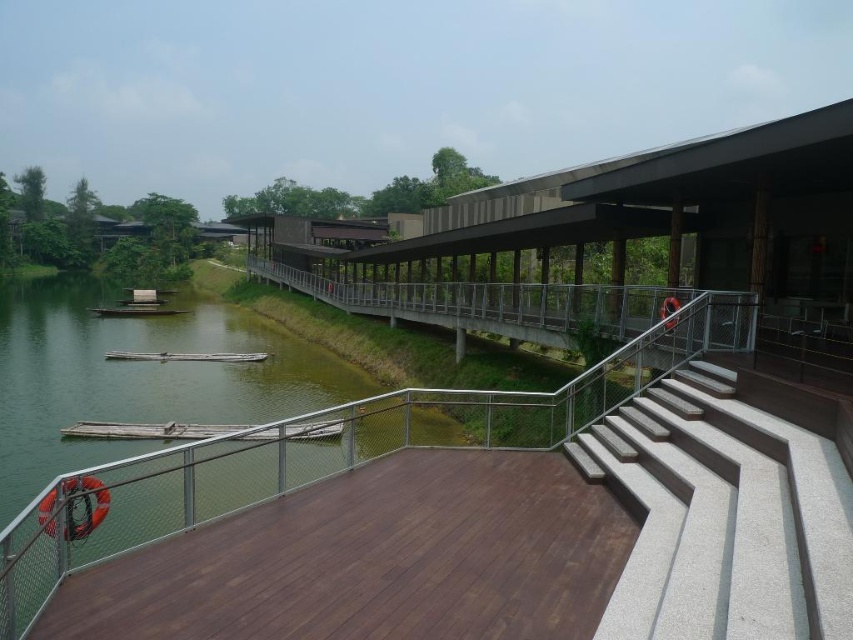
The height and width of the screenshot is (640, 853). What do you see at coordinates (373, 560) in the screenshot?
I see `brown wood deck at lower left` at bounding box center [373, 560].

Does point (502, 476) lie behind point (830, 518)?

Yes, point (502, 476) is farther from viewer.

Describe the element at coordinates (373, 560) in the screenshot. I see `brown wood deck at lower left` at that location.

Where is `brown wood deck at lower left`? This screenshot has width=853, height=640. brown wood deck at lower left is located at coordinates 373,560.